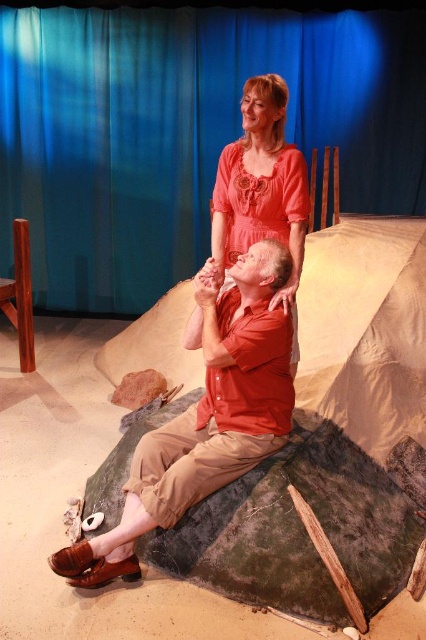
Which of these two, blue fabric curtain at upper center or matte red shirt at center, stands shorter?

matte red shirt at center

Describe the element at coordinates (184, 131) in the screenshot. This screenshot has height=640, width=426. I see `blue fabric curtain at upper center` at that location.

Find the location of a particular element. The height and width of the screenshot is (640, 426). blue fabric curtain at upper center is located at coordinates (184, 131).

Can you confirm if blue fabric curtain at upper center is smaller than matte orange dress at upper center?

Incorrect, blue fabric curtain at upper center is not smaller in size than matte orange dress at upper center.

Is blue fabric curtain at upper center to the left of matte orange dress at upper center from the viewer's perspective?

Yes, blue fabric curtain at upper center is to the left of matte orange dress at upper center.

Which is behind, point (342, 177) or point (270, 76)?

The point (342, 177) is behind.

At what (x,y) coordinates should I click in order to perform the action: click on blue fabric curtain at upper center. Please return your answer as a coordinate pair (x, y). The height and width of the screenshot is (640, 426). Looking at the image, I should click on (184, 131).

Is matte red shirt at center bigger than matte orange dress at upper center?

Yes.

Looking at this image, is matte red shirt at center shorter than matte orange dress at upper center?

Incorrect, matte red shirt at center's height does not fall short of matte orange dress at upper center's.

Locate an element on the screen. The height and width of the screenshot is (640, 426). matte red shirt at center is located at coordinates (206, 419).

This screenshot has width=426, height=640. What are the coordinates of `matte red shirt at center` in the screenshot? It's located at (206, 419).